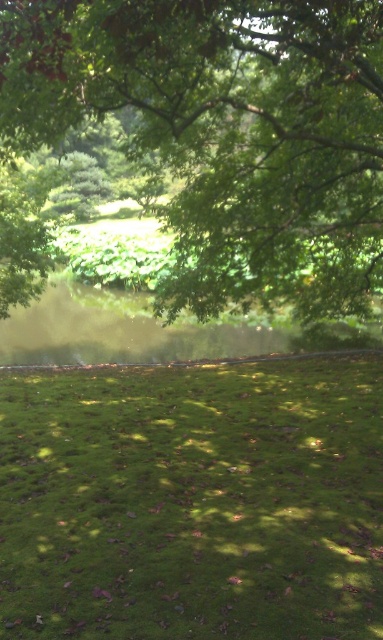
Is point (224, 477) farther from camera compared to point (315, 227)?

No.

Image resolution: width=383 pixels, height=640 pixels. I want to click on green grassy field at center, so click(193, 500).

Between point (258, 531) and point (73, 64), which one is positioned in front?

Point (258, 531) is more forward.

Where is `green grassy field at center`? The width and height of the screenshot is (383, 640). green grassy field at center is located at coordinates point(193,500).